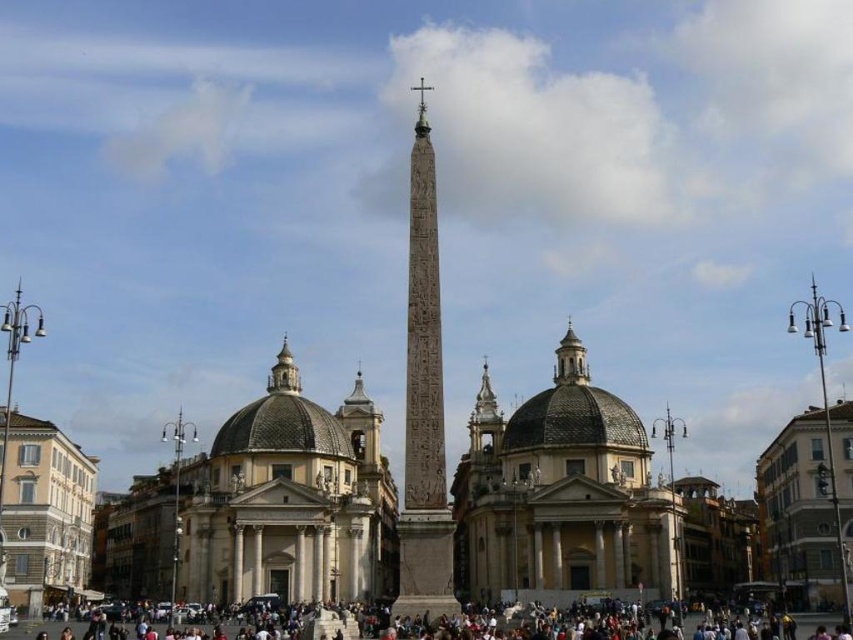
Question: Is light beige stone dome at center-left to the left of matte gray crowd at lower center from the viewer's perspective?

Choices:
 (A) no
 (B) yes

Answer: (B)

Question: Which point is closer to the camera?

Choices:
 (A) light beige stone dome at center-left
 (B) carved stone obelisk at center
 (C) beige stone dome at center

Answer: (B)

Question: Which point appears farthest from the camera in this image?

Choices:
 (A) (590, 435)
 (B) (270, 403)

Answer: (B)

Question: Is light beige stone dome at center-left smaller than matte gray crowd at lower center?

Choices:
 (A) yes
 (B) no

Answer: (B)

Question: Which point appears closest to the camera in this image?

Choices:
 (A) (210, 627)
 (B) (241, 570)
 (C) (564, 547)
 (D) (416, 369)

Answer: (D)

Question: In this image, where is matte gray crowd at lower center located relative to polished gold cross at center?

Choices:
 (A) above
 (B) below

Answer: (B)